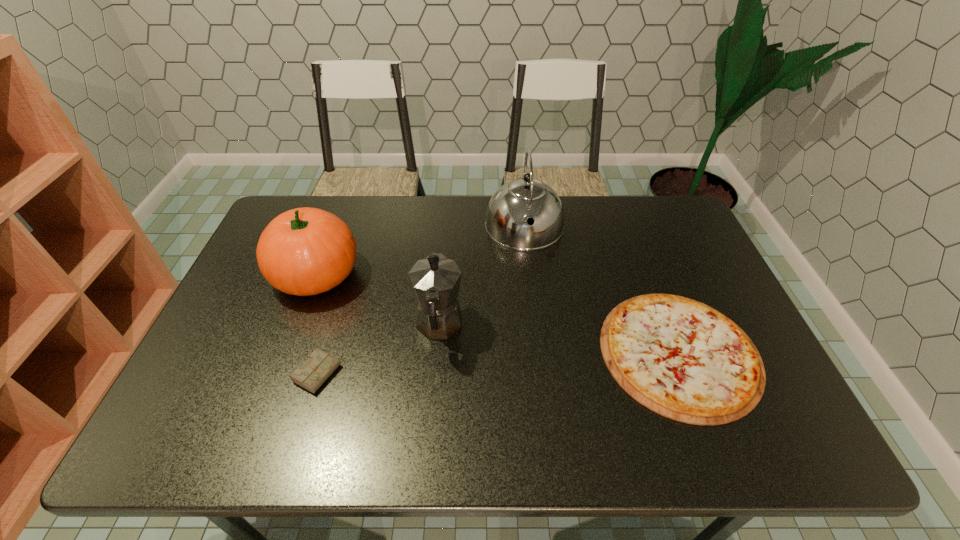
You are a GUI agent. You are given a task and a screenshot of the screen. Output one action in this format:
    pyautogui.click(x=<x>, y=<y>)
    Task: Click on the second object from right to left
    
    Given the screenshot: What is the action you would take?
    pyautogui.click(x=517, y=201)

At what (x,y) coordinates should I click in order to perform the action: click on coffeepot. Please return your answer as a coordinate pair (x, y). This screenshot has width=960, height=540. Looking at the image, I should click on (436, 279).

This screenshot has width=960, height=540. Identify the location of pumpkin. (305, 251).

The width and height of the screenshot is (960, 540). Identify the location of the second shortest object. (316, 370).

You are a GUI agent. You are given a task and a screenshot of the screen. Output one action in this format:
    pyautogui.click(x=<x>, y=<y>)
    Task: Click on the pizza
    This screenshot has width=960, height=540.
    Given the screenshot: What is the action you would take?
    pyautogui.click(x=680, y=358)

What are the coordinates of `the shortest object` in the screenshot? It's located at (680, 358).

Image resolution: width=960 pixels, height=540 pixels. Find the location of `vacant region located 0.170m from the spout of the kettle`. vacant region located 0.170m from the spout of the kettle is located at coordinates (532, 296).

Find the location of `vacant space located 0.050m on the pouring side of the coffeepot`. vacant space located 0.050m on the pouring side of the coffeepot is located at coordinates (443, 285).

Image resolution: width=960 pixels, height=540 pixels. Identify the location of free spot located on the pouring side of the coffeepot. click(x=447, y=232).

The image size is (960, 540). What are the coordinates of `vacant point located 0.180m on the pouring side of the coffeepot` in the screenshot? It's located at (445, 254).